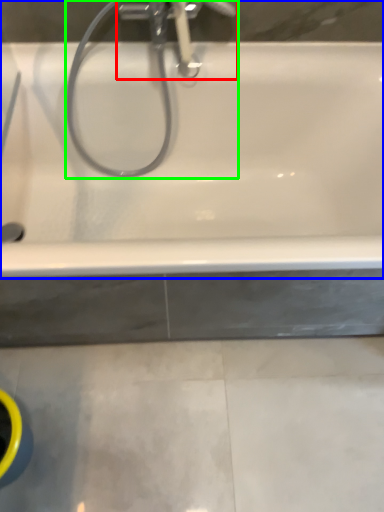
Question: Which is nearer to the tap (highlighted by a red box)? bathtub (highlighted by a blue box) or plumbing fixture (highlighted by a green box).

Choices:
 (A) bathtub
 (B) plumbing fixture

Answer: (B)